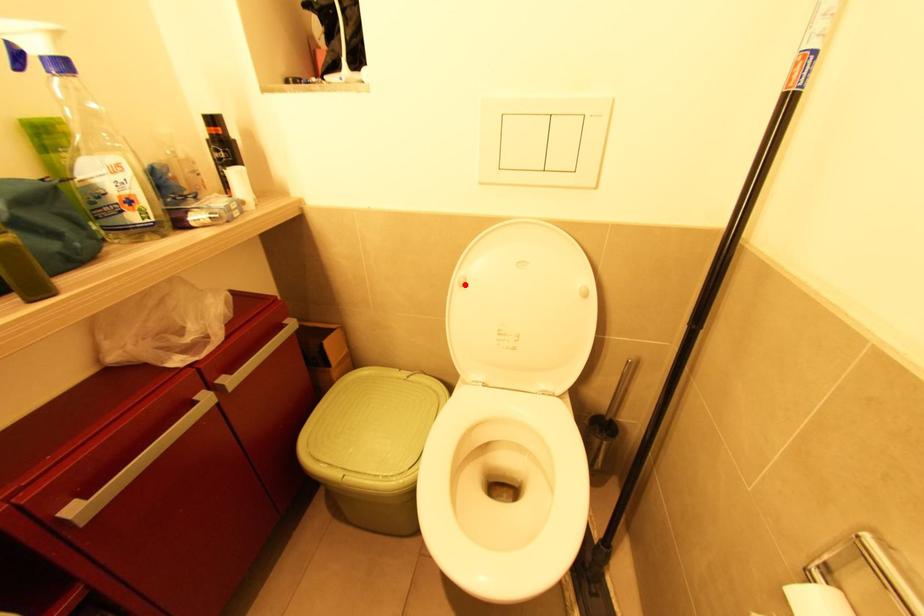
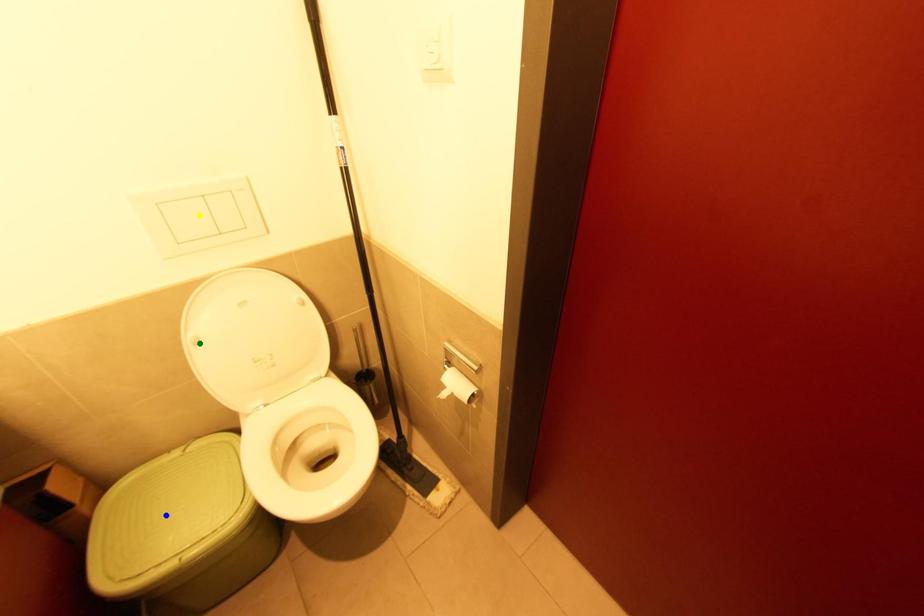
Question: I am providing you with two images of the same scene from different viewpoints. A red point is marked on the first image. You are given multiple points on the second image. Can you choose the point in image 2 that corresponds to the point in image 1?

Choices:
 (A) green point
 (B) yellow point
 (C) blue point

Answer: (A)